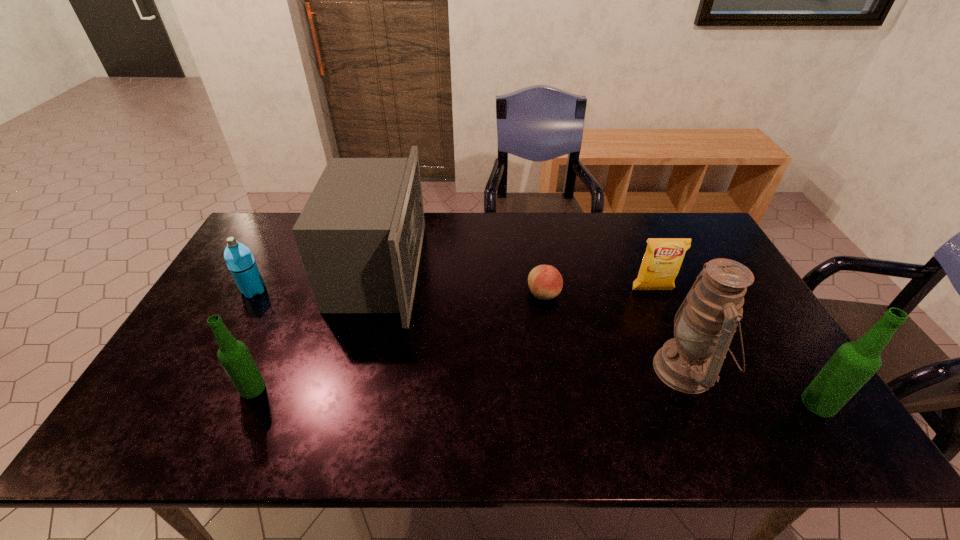
The height and width of the screenshot is (540, 960). What are the coordinates of `vacant space situated on the label of the sixth object from right to left` in the screenshot? It's located at (192, 388).

Image resolution: width=960 pixels, height=540 pixels. I want to click on vacant area located on the label of the sixth object from right to left, so click(163, 388).

What are the coordinates of `vacant area located on the label of the sixth object from right to left` in the screenshot? It's located at (204, 388).

The width and height of the screenshot is (960, 540). Identify the location of vacant space located 0.240m on the front-facing side of the microwave oven. (495, 271).

Where is `free space located 0.150m on the back of the thermos bottle`? This screenshot has width=960, height=540. free space located 0.150m on the back of the thermos bottle is located at coordinates (275, 252).

At what (x,y) coordinates should I click in order to perform the action: click on free space located on the right of the peach. Please return your answer as a coordinate pair (x, y). Looking at the image, I should click on (657, 294).

Locate an element on the screen. vacant position located on the front of the crisp (potato chip) with the logo is located at coordinates (690, 382).

Locate an element on the screen. This screenshot has width=960, height=540. free space located on the back of the oil lamp is located at coordinates (648, 279).

Find the location of `object that is positioned at the far edge`. object that is positioned at the far edge is located at coordinates (360, 234).

At what (x,y) coordinates should I click in order to perform the action: click on oil lamp that is at the near edge. Please return your answer as a coordinate pair (x, y). This screenshot has width=960, height=540. Looking at the image, I should click on (704, 325).